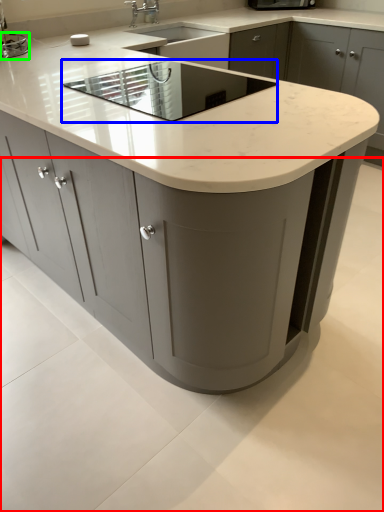
Question: Which is nearer to the concrete (highlighted by a red box)? appliance (highlighted by a blue box) or appliance (highlighted by a green box).

Choices:
 (A) appliance
 (B) appliance

Answer: (A)